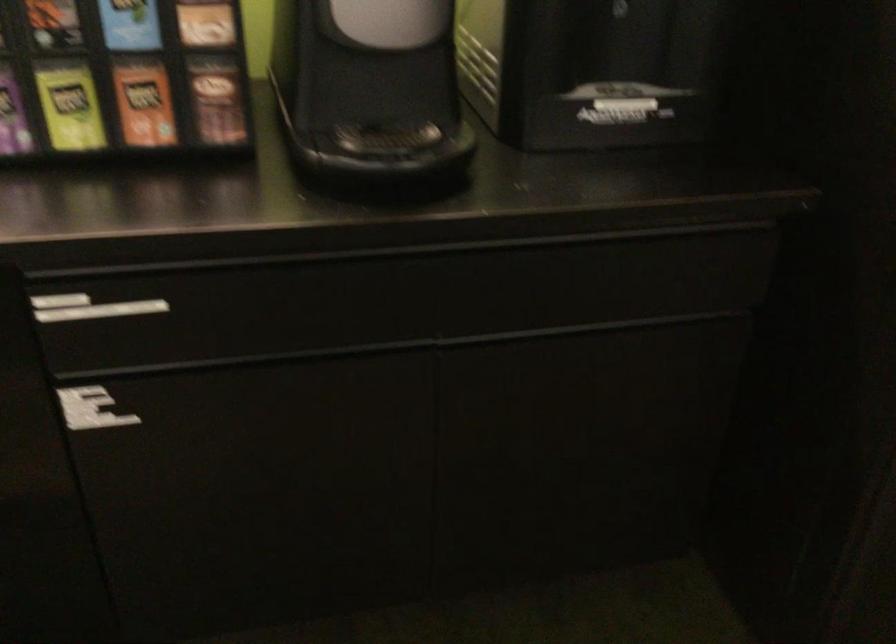
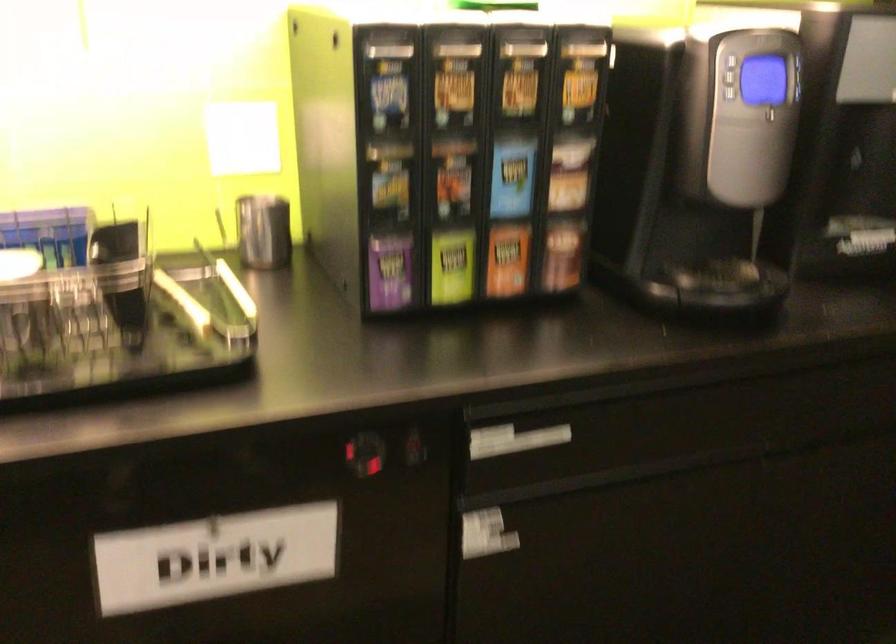
Question: What movement of the cameraman would produce the second image?

Choices:
 (A) Left
 (B) Right
 (C) Forward
 (D) Backward

Answer: (A)